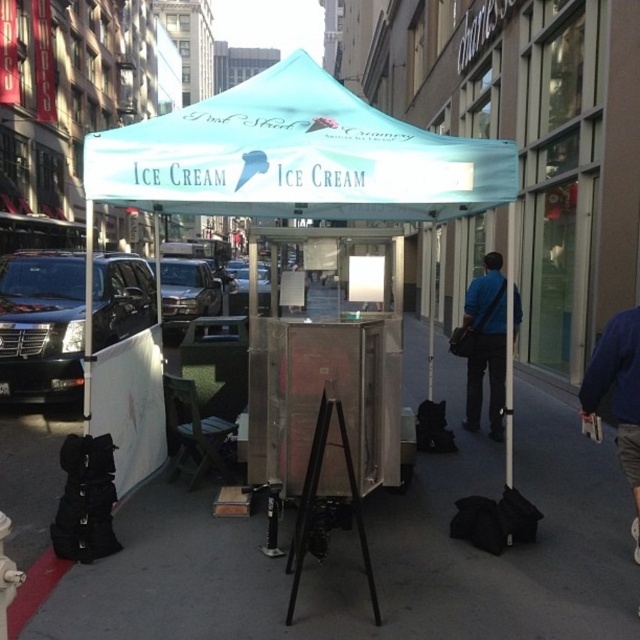
Between black leather bag at center and black metal tripod at center, which one has less height?

Standing shorter between the two is black metal tripod at center.

Between black leather bag at center and black metal tripod at center, which one appears on the right side from the viewer's perspective?

black leather bag at center

Is point (493, 397) farther from viewer compared to point (300, 556)?

Yes, point (493, 397) is behind point (300, 556).

In order to click on black leather bag at center in this screenshot , I will do `click(486, 346)`.

How far apart are teal fabric tent at center and teal fabric canopy at center?

4.88 feet

In the scene shown: Can you confirm if teal fabric tent at center is smaller than teal fabric canopy at center?

Correct, teal fabric tent at center occupies less space than teal fabric canopy at center.

Locate an element on the screen. teal fabric tent at center is located at coordinates (294, 157).

Which is in front, point (577, 550) or point (454, 157)?

Positioned in front is point (454, 157).

What do you see at coordinates (380, 556) in the screenshot? The width and height of the screenshot is (640, 640). I see `metallic pavement at center` at bounding box center [380, 556].

This screenshot has height=640, width=640. Find the location of `metallic pavement at center`. metallic pavement at center is located at coordinates (380, 556).